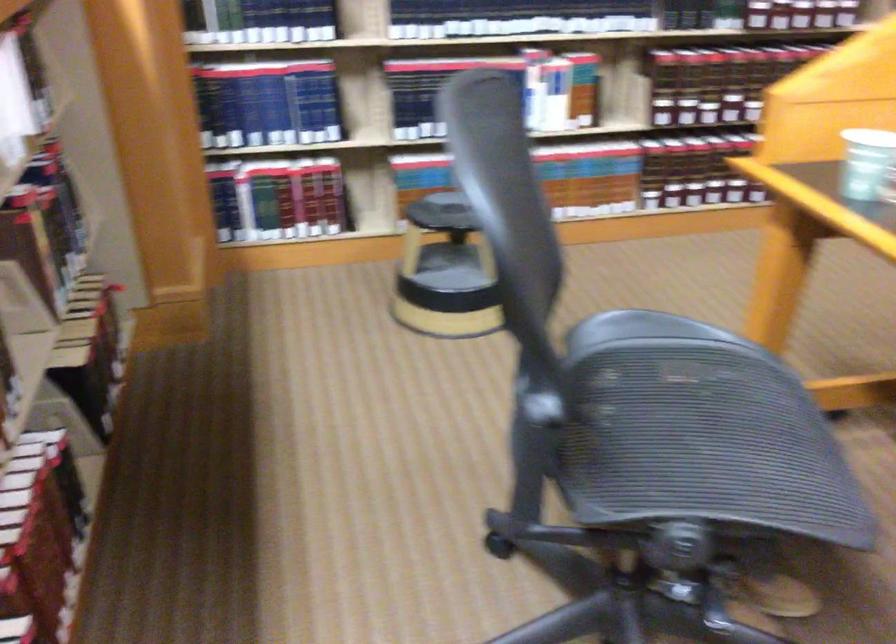
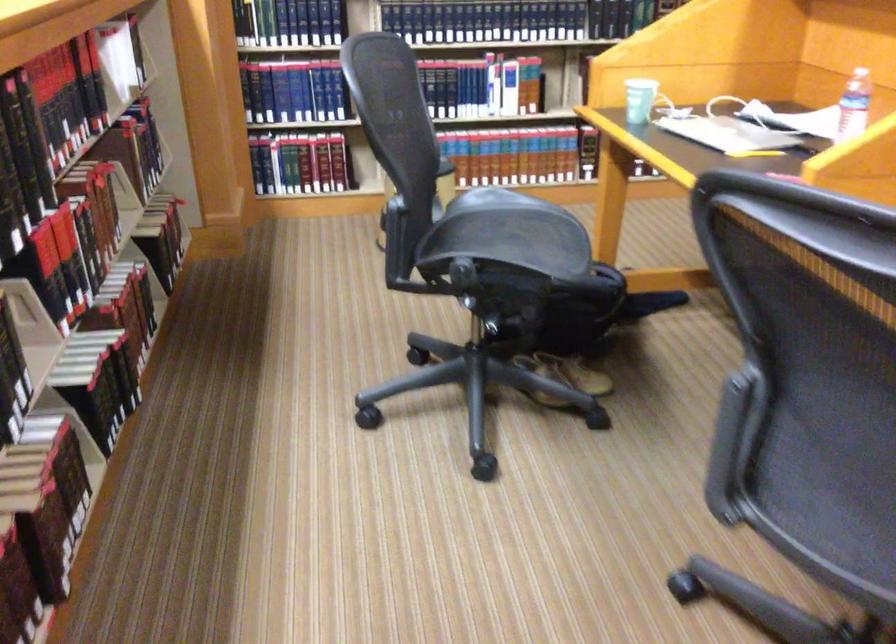
Locate, in the second image, the point that corresponds to point (587, 505) in the first image.

(433, 272)